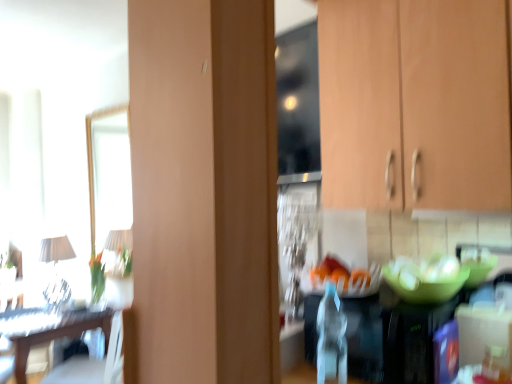
Question: From a real-world perspective, is wooden cabinet at upper right positioned above or below wooden table at left?

Choices:
 (A) below
 (B) above

Answer: (B)

Question: Visually, is wooden cabinet at upper right positioned to the left or to the right of wooden table at left?

Choices:
 (A) right
 (B) left

Answer: (A)

Question: Which is nearer to the wooden table at left?

Choices:
 (A) white fabric lampshade at left
 (B) clear plastic bottle at center
 (C) green matte glass bowl at center
 (D) wooden cabinet at upper right

Answer: (A)

Question: Considering the real-world distances, which object is closest to the clear plastic bottle at center?

Choices:
 (A) wooden table at left
 (B) wooden cabinet at upper right
 (C) white fabric lampshade at left
 (D) green matte glass bowl at center

Answer: (D)